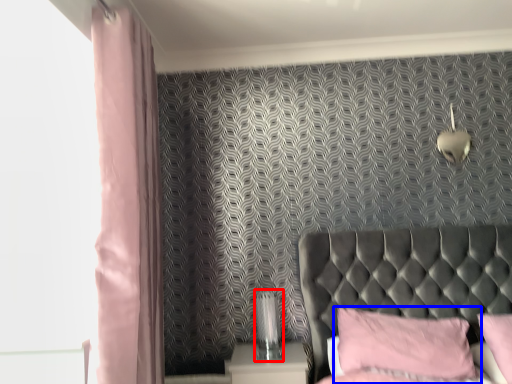
Question: Among these objects, which one is farthest to the camera, table lamp (highlighted by a red box) or pillow (highlighted by a blue box)?

Choices:
 (A) table lamp
 (B) pillow

Answer: (A)